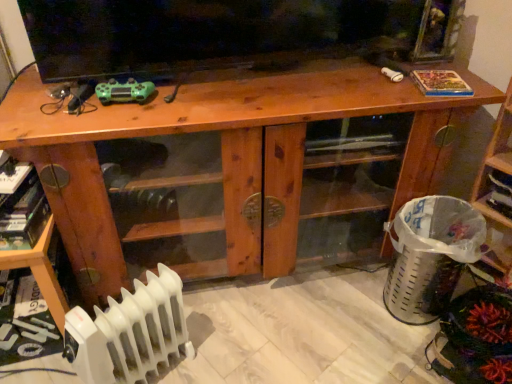
Question: Can you confirm if wooden cabinet at center is positioned to the left of green matte controller at upper left?

Choices:
 (A) yes
 (B) no

Answer: (B)

Question: Is the depth of wooden cabinet at center greater than that of green matte controller at upper left?

Choices:
 (A) yes
 (B) no

Answer: (B)

Question: From a real-world perspective, is wooden cabinet at center positioned under green matte controller at upper left based on gravity?

Choices:
 (A) no
 (B) yes

Answer: (B)

Question: Can you confirm if wooden cabinet at center is smaller than green matte controller at upper left?

Choices:
 (A) yes
 (B) no

Answer: (B)

Question: Does wooden cabinet at center turn towards green matte controller at upper left?

Choices:
 (A) no
 (B) yes

Answer: (A)

Question: Is wooden shelf at right, acting as the 2th shelf starting from the left, taller or shorter than wooden cabinet at center?

Choices:
 (A) short
 (B) tall

Answer: (B)

Question: From the image's perspective, is wooden shelf at right, acting as the 2th shelf starting from the left, located above or below wooden cabinet at center?

Choices:
 (A) above
 (B) below

Answer: (A)

Question: In the image, is wooden shelf at right, acting as the 2th shelf starting from the left, on the left side or the right side of wooden cabinet at center?

Choices:
 (A) left
 (B) right

Answer: (B)

Question: Is wooden shelf at right, acting as the 2th shelf starting from the left, wider or thinner than wooden cabinet at center?

Choices:
 (A) thin
 (B) wide

Answer: (A)

Question: Relative to wooden shelf at right, acting as the 2th shelf starting from the left, is wooden cabinet at center in front or behind?

Choices:
 (A) front
 (B) behind

Answer: (A)

Question: Does point (276, 273) appear closer or farther from the camera than point (501, 221)?

Choices:
 (A) closer
 (B) farther

Answer: (B)

Question: Looking at their shapes, would you say wooden cabinet at center is wider or thinner than wooden shelf at right, acting as the 2th shelf starting from the left?

Choices:
 (A) wide
 (B) thin

Answer: (A)

Question: Is wooden cabinet at center to the left or to the right of wooden shelf at right, the 1th shelf viewed from the right, in the image?

Choices:
 (A) left
 (B) right

Answer: (A)

Question: Is white plastic radiator at lower left in front of or behind wooden cabinet at center in the image?

Choices:
 (A) front
 (B) behind

Answer: (A)

Question: From a real-world perspective, relative to wooden cabinet at center, is white plastic radiator at lower left vertically above or below?

Choices:
 (A) above
 (B) below

Answer: (B)